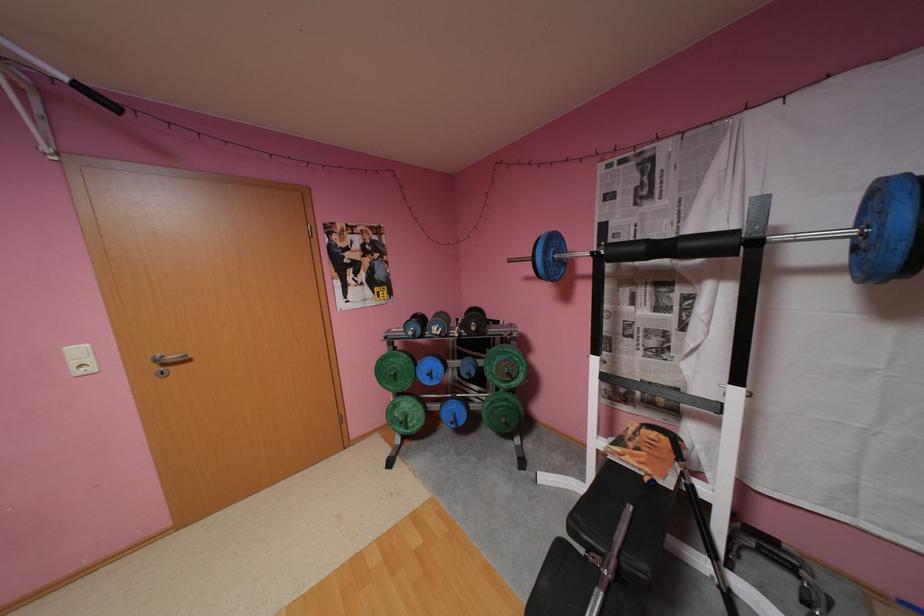
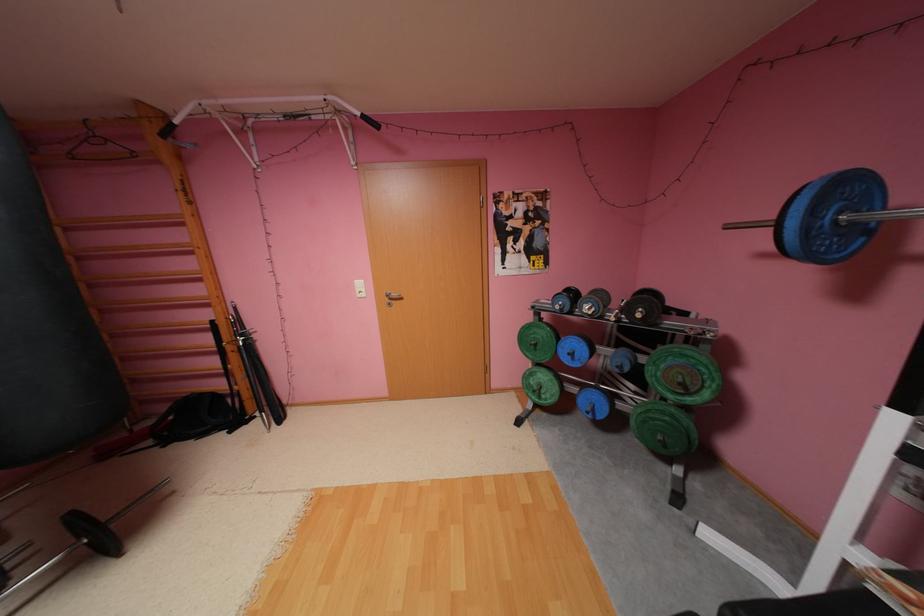
Where in the second image is the point corresponding to [513,419] from the first image?

(669, 438)